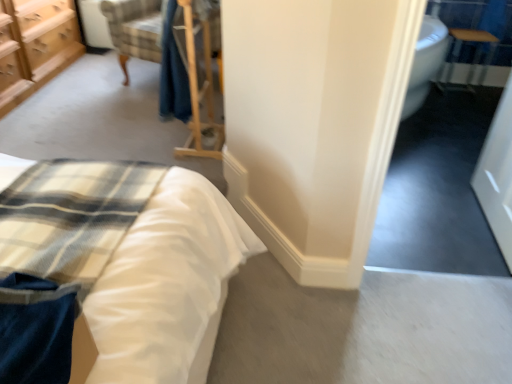
Find the location of `wooden table at upper right`. wooden table at upper right is located at coordinates (473, 59).

Describe the element at coordinates (216, 262) in the screenshot. I see `satin white bed at lower left` at that location.

What are the coordinates of `wooden chest of drawers at upper left` in the screenshot? It's located at (36, 46).

The width and height of the screenshot is (512, 384). Describe the element at coordinates (498, 175) in the screenshot. I see `white glossy door at right` at that location.

Locate an element on the screen. This screenshot has height=384, width=512. wooden table at upper right is located at coordinates (473, 59).

Considering the relative sizes of wooden table at upper right and wooden chest of drawers at upper left in the image provided, is wooden table at upper right taller than wooden chest of drawers at upper left?

Incorrect, the height of wooden table at upper right is not larger of that of wooden chest of drawers at upper left.

Do you think wooden table at upper right is within wooden chest of drawers at upper left, or outside of it?

wooden table at upper right is located beyond the bounds of wooden chest of drawers at upper left.

Which is in front, wooden table at upper right or wooden chest of drawers at upper left?

wooden chest of drawers at upper left is in front.

From the image's perspective, who appears lower, satin white bed at lower left or wooden chest of drawers at upper left?

From the image's view, satin white bed at lower left is below.

How many degrees apart are the facing directions of satin white bed at lower left and wooden chest of drawers at upper left?

2.12 degrees.

In the image, is satin white bed at lower left on the left side or the right side of wooden chest of drawers at upper left?

Clearly, satin white bed at lower left is on the right of wooden chest of drawers at upper left in the image.

This screenshot has height=384, width=512. Find the location of `bed that appears in front of the wooden chest of drawers at upper left`. bed that appears in front of the wooden chest of drawers at upper left is located at coordinates (216, 262).

Where is `screen door that appears below the wooden chest of drawers at upper left (from the image's perspective)`? This screenshot has width=512, height=384. screen door that appears below the wooden chest of drawers at upper left (from the image's perspective) is located at coordinates (498, 175).

Between white glossy door at right and wooden chest of drawers at upper left, which one is positioned behind?

wooden chest of drawers at upper left is more distant.

Can we say white glossy door at right lies outside wooden chest of drawers at upper left?

Absolutely, white glossy door at right is external to wooden chest of drawers at upper left.

Is point (506, 261) closer or farther from the camera than point (466, 90)?

Point (506, 261).

Between white glossy door at right and wooden table at upper right, which one has larger size?

With larger size is white glossy door at right.

From a real-world perspective, is white glossy door at right located beneath satin white bed at lower left?

No, from a real-world perspective, white glossy door at right is not beneath satin white bed at lower left.

Is satin white bed at lower left completely or partially inside white glossy door at right?

No, satin white bed at lower left is not surrounded by white glossy door at right.

This screenshot has height=384, width=512. In the image, there is a satin white bed at lower left. In order to click on screen door above it (from the image's perspective) in this screenshot , I will do 498,175.

Is white glossy door at right closer to the viewer compared to satin white bed at lower left?

That is False.

Could you tell me if wooden table at upper right is facing satin white bed at lower left?

No, wooden table at upper right is not facing towards satin white bed at lower left.

Considering the relative sizes of wooden table at upper right and satin white bed at lower left in the image provided, is wooden table at upper right bigger than satin white bed at lower left?

No, wooden table at upper right is not bigger than satin white bed at lower left.

From the image's perspective, is wooden table at upper right located above satin white bed at lower left?

Indeed, from the image's perspective, wooden table at upper right is shown above satin white bed at lower left.

In the image, there is a satin white bed at lower left. Find the location of `table below it (from a real-world perspective)`. table below it (from a real-world perspective) is located at coordinates (473, 59).

Measure the distance from satin white bed at lower left to white glossy door at right.

1.48 meters.

Which object is more forward, satin white bed at lower left or white glossy door at right?

Positioned in front is satin white bed at lower left.

Is satin white bed at lower left aimed at white glossy door at right?

No, satin white bed at lower left is not facing towards white glossy door at right.

In terms of width, does satin white bed at lower left look wider or thinner when compared to white glossy door at right?

In the image, satin white bed at lower left appears to be wider than white glossy door at right.

Image resolution: width=512 pixels, height=384 pixels. What are the coordinates of `chest of drawers above the wooden table at upper right (from the image's perspective)` in the screenshot? It's located at (36, 46).

Where is `bed that appears below the wooden chest of drawers at upper left (from a real-world perspective)`? Image resolution: width=512 pixels, height=384 pixels. bed that appears below the wooden chest of drawers at upper left (from a real-world perspective) is located at coordinates (216, 262).

From the image, which object appears to be nearer to white glossy door at right, wooden chest of drawers at upper left or satin white bed at lower left?

Based on the image, satin white bed at lower left appears to be nearer to white glossy door at right.

Which object lies nearer to the anchor point wooden table at upper right, satin white bed at lower left or white glossy door at right?

white glossy door at right lies closer to wooden table at upper right than the other object.

Looking at the image, which one is located further to satin white bed at lower left, white glossy door at right or wooden table at upper right?

Among the two, wooden table at upper right is located further to satin white bed at lower left.

From the image, which object appears to be nearer to white glossy door at right, wooden table at upper right or wooden chest of drawers at upper left?

Among the two, wooden table at upper right is located nearer to white glossy door at right.

In the scene shown: Which object lies further to the anchor point white glossy door at right, wooden chest of drawers at upper left or wooden table at upper right?

Among the two, wooden chest of drawers at upper left is located further to white glossy door at right.

Looking at the image, which one is located closer to wooden table at upper right, white glossy door at right or wooden chest of drawers at upper left?

The object closer to wooden table at upper right is white glossy door at right.

Looking at the image, which one is located closer to wooden chest of drawers at upper left, white glossy door at right or satin white bed at lower left?

Based on the image, satin white bed at lower left appears to be nearer to wooden chest of drawers at upper left.

When comparing their distances from wooden table at upper right, does wooden chest of drawers at upper left or satin white bed at lower left seem further?

wooden chest of drawers at upper left is further to wooden table at upper right.

At what (x,y) coordinates should I click in order to perform the action: click on screen door between wooden chest of drawers at upper left and wooden table at upper right. Please return your answer as a coordinate pair (x, y). The image size is (512, 384). Looking at the image, I should click on (498, 175).

Locate an element on the screen. This screenshot has height=384, width=512. bed between wooden chest of drawers at upper left and wooden table at upper right is located at coordinates (216, 262).

At what (x,y) coordinates should I click in order to perform the action: click on bed located between wooden chest of drawers at upper left and white glossy door at right in the left-right direction. Please return your answer as a coordinate pair (x, y). Looking at the image, I should click on (216, 262).

Where is `screen door between satin white bed at lower left and wooden table at upper right along the z-axis`? This screenshot has width=512, height=384. screen door between satin white bed at lower left and wooden table at upper right along the z-axis is located at coordinates (498, 175).